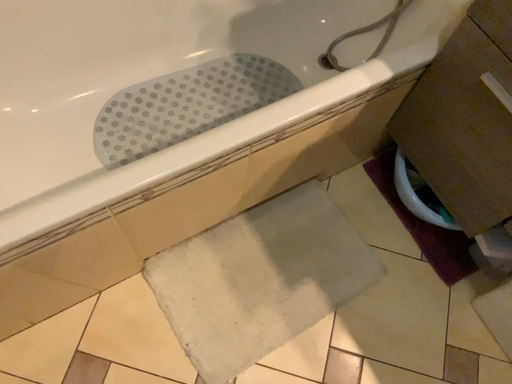
Based on the photo, how much space does white soft bath mat at lower center, which ranks as the first bath mat in left-to-right order, occupy vertically?

1.25 inches.

Image resolution: width=512 pixels, height=384 pixels. What do you see at coordinates (260, 279) in the screenshot?
I see `white soft bath mat at lower center, which ranks as the first bath mat in left-to-right order` at bounding box center [260, 279].

The image size is (512, 384). Identify the location of white glossy toilet bowl at lower right. (415, 196).

The image size is (512, 384). What are the coordinates of `white soft bath mat at lower center, positioned as the 2th bath mat in right-to-left order` in the screenshot? It's located at (260, 279).

Based on their positions, is white glossy toilet bowl at lower right located to the left or right of beige matte tile at lower right?

In the image, white glossy toilet bowl at lower right appears on the left side of beige matte tile at lower right.

Is white glossy toilet bowl at lower right thinner than beige matte tile at lower right?

Correct, the width of white glossy toilet bowl at lower right is less than that of beige matte tile at lower right.

What's the angular difference between white glossy toilet bowl at lower right and beige matte tile at lower right's facing directions?

The angular difference between white glossy toilet bowl at lower right and beige matte tile at lower right is 0.000379 degrees.

From a real-world perspective, which object rests below the other?

beige matte tile at lower right.

Between white soft bath mat at lower center, which ranks as the first bath mat in left-to-right order, and white rubber mat at upper center, which one has less height?

white soft bath mat at lower center, which ranks as the first bath mat in left-to-right order.

Is point (322, 294) closer or farther from the camera than point (60, 75)?

Point (322, 294).

From a real-world perspective, which is physically above, white soft bath mat at lower center, which ranks as the first bath mat in left-to-right order, or white rubber mat at upper center?

white rubber mat at upper center is physically above.

From the white rubber mat at upper center, count 1st bath mat to the right and point to it. Please provide its 2D coordinates.

[(260, 279)]

The width and height of the screenshot is (512, 384). Find the location of `bath mat that is the 2nd object directly below the white glossy toilet bowl at lower right (from a real-world perspective)`. bath mat that is the 2nd object directly below the white glossy toilet bowl at lower right (from a real-world perspective) is located at coordinates (260, 279).

Does white soft bath mat at lower center, which ranks as the first bath mat in left-to-right order, come in front of white glossy toilet bowl at lower right?

Yes, white soft bath mat at lower center, which ranks as the first bath mat in left-to-right order, is closer to the camera.

From the image's perspective, is white soft bath mat at lower center, which ranks as the first bath mat in left-to-right order, below purple fabric bath mat at lower right, acting as the 2th bath mat starting from the left?

Yes, from the image's perspective, white soft bath mat at lower center, which ranks as the first bath mat in left-to-right order, is beneath purple fabric bath mat at lower right, acting as the 2th bath mat starting from the left.

Is white soft bath mat at lower center, positioned as the 2th bath mat in right-to-left order, to the left or to the right of purple fabric bath mat at lower right, acting as the 2th bath mat starting from the left, in the image?

white soft bath mat at lower center, positioned as the 2th bath mat in right-to-left order, is positioned on purple fabric bath mat at lower right, acting as the 2th bath mat starting from the left,'s left side.

Which object is further away from the camera, white soft bath mat at lower center, positioned as the 2th bath mat in right-to-left order, or purple fabric bath mat at lower right, acting as the 2th bath mat starting from the left?

Positioned behind is purple fabric bath mat at lower right, acting as the 2th bath mat starting from the left.

From the picture: Is white soft bath mat at lower center, which ranks as the first bath mat in left-to-right order, bigger than purple fabric bath mat at lower right, acting as the 2th bath mat starting from the left?

Yes.

You are a GUI agent. You are given a task and a screenshot of the screen. Output one action in this format:
    pyautogui.click(x=<x>, y=<y>)
    Task: Click on the toilet bowl on the left of beige matte tile at lower right
    Image resolution: width=512 pixels, height=384 pixels.
    Given the screenshot: What is the action you would take?
    pyautogui.click(x=415, y=196)

Considering the positions of points (466, 319) and (397, 178), is point (466, 319) closer to camera compared to point (397, 178)?

Yes, point (466, 319) is in front of point (397, 178).

Looking at this image, can you tell me how much beige matte tile at lower right and white glossy toilet bowl at lower right differ in facing direction?

0.000379 degrees.

In the scene shown: Is white glossy toilet bowl at lower right positioned behind white soft bath mat at lower center, positioned as the 2th bath mat in right-to-left order?

Yes, it is.

Is white soft bath mat at lower center, positioned as the 2th bath mat in right-to-left order, surrounded by white glossy toilet bowl at lower right?

No.

Measure the distance between white glossy toilet bowl at lower right and white soft bath mat at lower center, which ranks as the first bath mat in left-to-right order.

A distance of 19.06 inches exists between white glossy toilet bowl at lower right and white soft bath mat at lower center, which ranks as the first bath mat in left-to-right order.

Based on their sizes in the image, would you say white rubber mat at upper center is bigger or smaller than beige matte tile at lower right?

white rubber mat at upper center is bigger than beige matte tile at lower right.

In terms of width, does white rubber mat at upper center look wider or thinner when compared to beige matte tile at lower right?

Considering their sizes, white rubber mat at upper center looks broader than beige matte tile at lower right.

Find the location of `ceramic tile that appears below the white rubber mat at upper center (from a real-world perspective)`. ceramic tile that appears below the white rubber mat at upper center (from a real-world perspective) is located at coordinates (470, 318).

Which object is positioned more to the left, white rubber mat at upper center or beige matte tile at lower right?

white rubber mat at upper center is more to the left.

Find the location of a particular element. This screenshot has height=384, width=512. ceramic tile that appears below the white glossy toilet bowl at lower right (from the image's perspective) is located at coordinates (470, 318).

Where is `bathtub in front of the white soft bath mat at lower center, which ranks as the first bath mat in left-to-right order`? The width and height of the screenshot is (512, 384). bathtub in front of the white soft bath mat at lower center, which ranks as the first bath mat in left-to-right order is located at coordinates (x=165, y=73).

Considering their positions, is purple fabric bath mat at lower right, positioned as the first bath mat in right-to-left order, positioned further to beige matte tile at lower right than white soft bath mat at lower center, which ranks as the first bath mat in left-to-right order?

white soft bath mat at lower center, which ranks as the first bath mat in left-to-right order.

Estimate the real-world distances between objects in this image. Which object is further from white soft bath mat at lower center, which ranks as the first bath mat in left-to-right order, white rubber mat at upper center or purple fabric bath mat at lower right, positioned as the first bath mat in right-to-left order?

The object further to white soft bath mat at lower center, which ranks as the first bath mat in left-to-right order, is white rubber mat at upper center.

When comparing their distances from beige matte tile at lower right, does white rubber mat at upper center or white glossy toilet bowl at lower right seem further?

white rubber mat at upper center is positioned further to the anchor beige matte tile at lower right.

When comparing their distances from white glossy toilet bowl at lower right, does purple fabric bath mat at lower right, positioned as the first bath mat in right-to-left order, or white rubber mat at upper center seem closer?

purple fabric bath mat at lower right, positioned as the first bath mat in right-to-left order.

Based on their spatial positions, is white rubber mat at upper center or purple fabric bath mat at lower right, positioned as the first bath mat in right-to-left order, further from white glossy toilet bowl at lower right?

Among the two, white rubber mat at upper center is located further to white glossy toilet bowl at lower right.

Considering their positions, is white rubber mat at upper center positioned closer to white soft bath mat at lower center, which ranks as the first bath mat in left-to-right order, than white glossy toilet bowl at lower right?

Based on the image, white glossy toilet bowl at lower right appears to be nearer to white soft bath mat at lower center, which ranks as the first bath mat in left-to-right order.

Looking at the image, which one is located closer to beige matte tile at lower right, white glossy toilet bowl at lower right or white soft bath mat at lower center, positioned as the 2th bath mat in right-to-left order?

Based on the image, white glossy toilet bowl at lower right appears to be nearer to beige matte tile at lower right.

Based on their spatial positions, is white glossy toilet bowl at lower right or beige matte tile at lower right further from white rubber mat at upper center?

beige matte tile at lower right is further to white rubber mat at upper center.

This screenshot has width=512, height=384. Identify the location of toilet bowl between white soft bath mat at lower center, positioned as the 2th bath mat in right-to-left order, and beige matte tile at lower right, in the horizontal direction. (415, 196).

The image size is (512, 384). I want to click on bath mat situated between white soft bath mat at lower center, which ranks as the first bath mat in left-to-right order, and beige matte tile at lower right from left to right, so click(x=424, y=227).

The image size is (512, 384). What are the coordinates of `toilet bowl located between white soft bath mat at lower center, which ranks as the first bath mat in left-to-right order, and purple fabric bath mat at lower right, positioned as the first bath mat in right-to-left order, in the left-right direction` in the screenshot? It's located at (415, 196).

The width and height of the screenshot is (512, 384). Identify the location of bath mat located between white rubber mat at upper center and purple fabric bath mat at lower right, positioned as the first bath mat in right-to-left order, in the left-right direction. (260, 279).